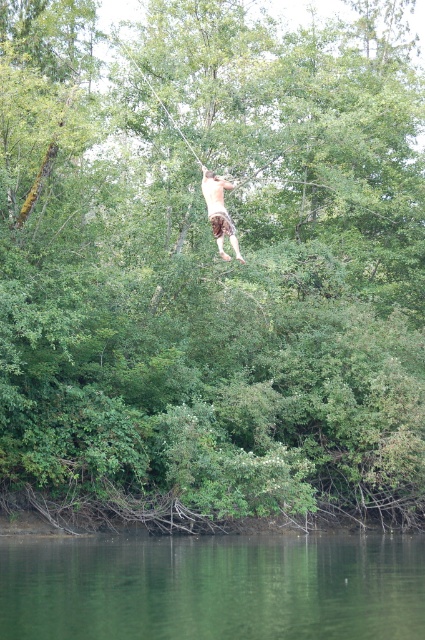
You are standing at the edge of the scene and want to jump into the green smooth water at lower center. Based on the distance provided, is this a safe distance for a jump considering typical safety standards?

The green smooth water at lower center is 43.20 feet from the viewer. According to safety guidelines, a jump from such a height requires a minimum depth of at least 12 feet to avoid injury. Since the water depth here is sufficient, it is safe to jump.

You are a park ranger who needs to rescue someone swinging from a rope. You have a rescue rope that is 8 meters long. The person is wearing brown textured shorts at center and is swinging over the green smooth water at lower center. Can your rescue rope reach them from the edge of the water?

The distance between the green smooth water at lower center and the brown textured shorts at center is 8.89 meters. Since your rescue rope is only 8 meters long, it cannot reach the person swinging from the rope.